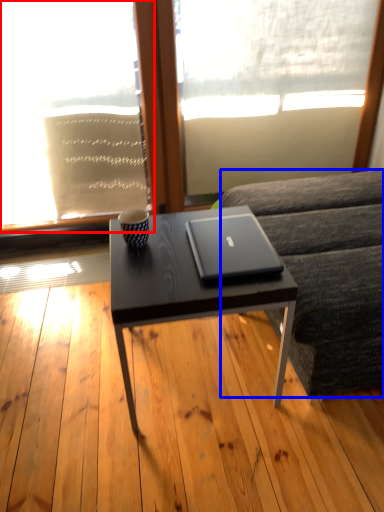
Question: Which object appears closest to the camera in this image, window screen (highlighted by a red box) or studio couch (highlighted by a blue box)?

Choices:
 (A) window screen
 (B) studio couch

Answer: (B)